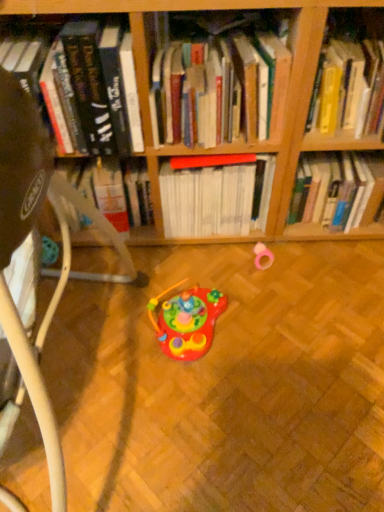
The height and width of the screenshot is (512, 384). What are the coordinates of `vacant space that's between shiny plastic toy at center, placed as the 2th toy when sorted from right to left, and pink rubber ring at center right, which ranks as the 1th toy in right-to-left order` in the screenshot? It's located at (239, 290).